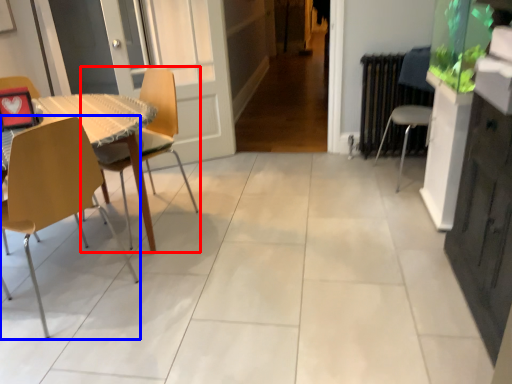
Question: Which object is closer to the camera taking this photo, chair (highlighted by a red box) or chair (highlighted by a blue box)?

Choices:
 (A) chair
 (B) chair

Answer: (B)